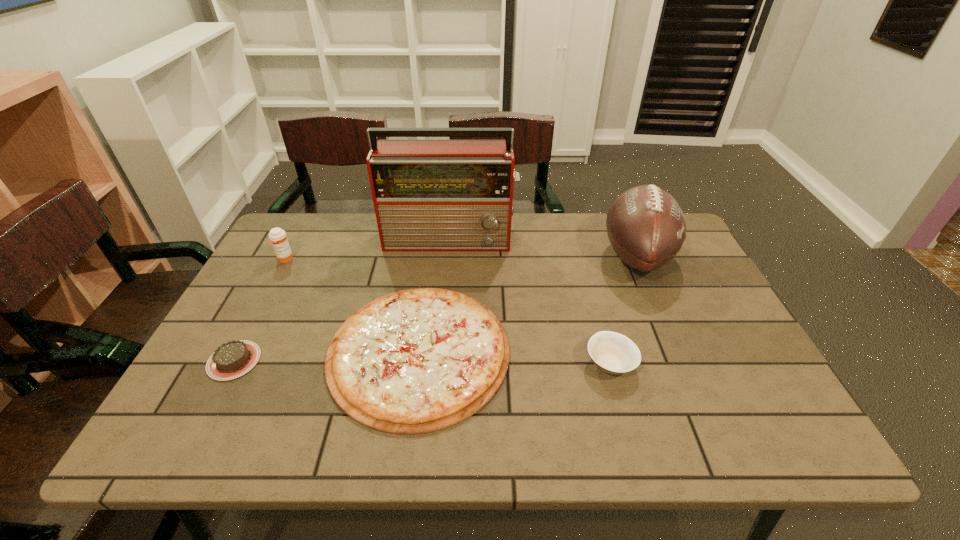
Image resolution: width=960 pixels, height=540 pixels. Identify the location of vacant space that is in between the radio receiver and the third shortest object. (530, 301).

You are a GUI agent. You are given a task and a screenshot of the screen. Output one action in this format:
    pyautogui.click(x=<x>, y=<y>)
    Task: Click on the free space between the third tallest object and the second tallest object
    The image size is (960, 540).
    Given the screenshot: What is the action you would take?
    (x=461, y=258)

I want to click on free space that is in between the bowl and the radio receiver, so click(x=530, y=301).

Where is `object that stands as the closest to the pizza`? object that stands as the closest to the pizza is located at coordinates (233, 359).

Identify which object is the second nearest to the medicine. Please provide its 2D coordinates. Your answer should be formatted as a tuple, i.e. [(x, y)], where the tuple contains the x and y coordinates of a point satisfying the conditions above.

[(429, 195)]

You are a GUI agent. You are given a task and a screenshot of the screen. Output one action in this format:
    pyautogui.click(x=<x>, y=<y>)
    Task: Click on the free location that satisfies the following two spatial constraints: 1. on the front side of the bowl; 2. on the right side of the chocolate cake
    The height and width of the screenshot is (540, 960).
    Given the screenshot: What is the action you would take?
    pyautogui.click(x=232, y=364)

You are a GUI agent. You are given a task and a screenshot of the screen. Output one action in this format:
    pyautogui.click(x=<x>, y=<y>)
    Task: Click on the vacant region that satisfies the following two spatial constraints: 1. on the front-facing side of the fifth shortest object; 2. on the right side of the radio receiver
    This screenshot has height=540, width=960.
    Given the screenshot: What is the action you would take?
    pyautogui.click(x=449, y=256)

Locate an element on the screen. free space that satisfies the following two spatial constraints: 1. on the front-facing side of the fifth shortest object; 2. on the left side of the tallest object is located at coordinates (449, 256).

You are a GUI agent. You are given a task and a screenshot of the screen. Output one action in this format:
    pyautogui.click(x=<x>, y=<y>)
    Task: Click on the free space in the image that satisfies the following two spatial constraints: 1. on the front-facing side of the tallest object; 2. on the left side of the football (American)
    The height and width of the screenshot is (540, 960).
    Given the screenshot: What is the action you would take?
    pyautogui.click(x=449, y=256)

I want to click on free spot that satisfies the following two spatial constraints: 1. on the front-facing side of the radio receiver; 2. on the left side of the bowl, so click(440, 364).